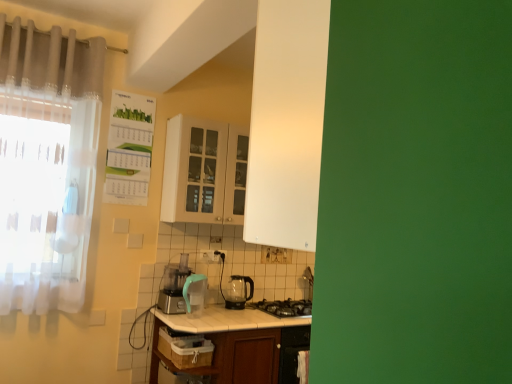
Question: Is white sheer curtain at left, which is the 2th curtain in top-to-bottom order, closer to the viewer compared to matte white cabinet at center?

Choices:
 (A) no
 (B) yes

Answer: (B)

Question: From the image's perspective, is white sheer curtain at left, which is the 1th curtain in bottom-to-top order, below matte white cabinet at center?

Choices:
 (A) no
 (B) yes

Answer: (B)

Question: Is white sheer curtain at left, which is the 1th curtain in bottom-to-top order, further to camera compared to matte white cabinet at center?

Choices:
 (A) yes
 (B) no

Answer: (B)

Question: Is matte white cabinet at center a part of white sheer curtain at left, which is the 2th curtain in top-to-bottom order?

Choices:
 (A) yes
 (B) no

Answer: (B)

Question: Can you confirm if white sheer curtain at left, which is the 1th curtain in bottom-to-top order, is shorter than matte white cabinet at center?

Choices:
 (A) no
 (B) yes

Answer: (A)

Question: From the image's perspective, relative to black plastic electric outlet at center, is white glossy table at center above or below?

Choices:
 (A) above
 (B) below

Answer: (B)

Question: Is white glossy table at center wider or thinner than black plastic electric outlet at center?

Choices:
 (A) thin
 (B) wide

Answer: (B)

Question: Considering the positions of white glossy table at center and black plastic electric outlet at center in the image, is white glossy table at center taller or shorter than black plastic electric outlet at center?

Choices:
 (A) tall
 (B) short

Answer: (A)

Question: Does point 306,331 appear closer or farther from the camera than point 218,253?

Choices:
 (A) closer
 (B) farther

Answer: (A)

Question: Relative to matte white cabinet at center, is white sheer curtain at left, which is the 1th curtain in bottom-to-top order, in front or behind?

Choices:
 (A) front
 (B) behind

Answer: (A)

Question: In terms of size, does white sheer curtain at left, which is the 2th curtain in top-to-bottom order, appear bigger or smaller than matte white cabinet at center?

Choices:
 (A) small
 (B) big

Answer: (A)

Question: Is white sheer curtain at left, which is the 2th curtain in top-to-bottom order, wider or thinner than matte white cabinet at center?

Choices:
 (A) thin
 (B) wide

Answer: (A)

Question: Is point (20, 309) closer or farther from the camera than point (242, 221)?

Choices:
 (A) farther
 (B) closer

Answer: (B)

Question: From the image's perspective, is transparent glass kettle at center positioned above or below translucent fabric curtain at upper left, marked as the first curtain in a top-to-bottom arrangement?

Choices:
 (A) below
 (B) above

Answer: (A)

Question: Is transparent glass kettle at center in front of or behind translucent fabric curtain at upper left, the 2th curtain from the bottom, in the image?

Choices:
 (A) front
 (B) behind

Answer: (B)